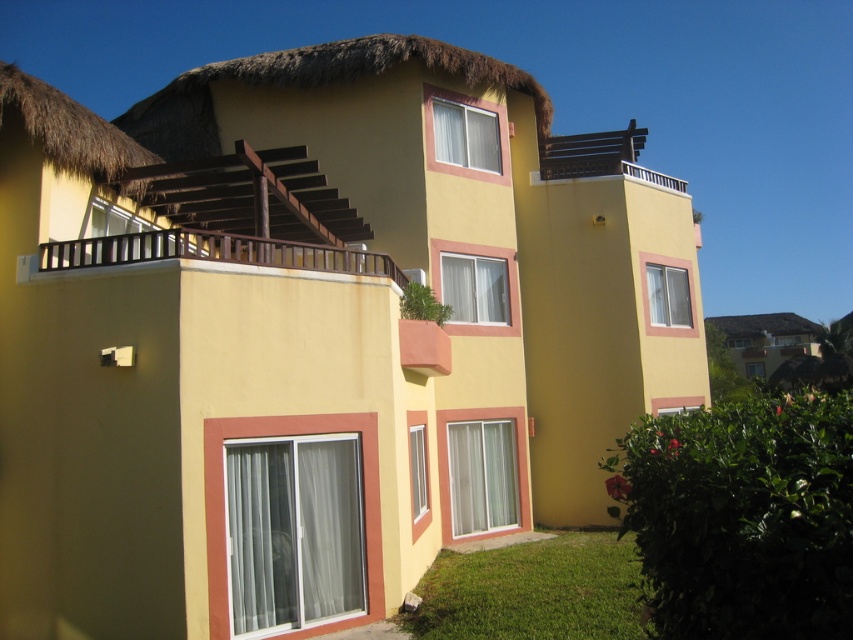
Question: Which object is positioned closest to the thatched straw hut at upper right?

Choices:
 (A) thatched straw roof at upper right
 (B) wooden at upper left
 (C) white wooden balcony at upper center

Answer: (A)

Question: Can you confirm if thatched straw hut at upper right is positioned to the right of white wooden balcony at upper center?

Choices:
 (A) no
 (B) yes

Answer: (B)

Question: Among these points, which one is nearest to the camera?

Choices:
 (A) (804, 323)
 (B) (749, 316)
 (C) (596, 145)

Answer: (C)

Question: Does wooden at upper left have a greater width compared to thatched straw hut at upper right?

Choices:
 (A) no
 (B) yes

Answer: (A)

Question: Which point is closer to the camera?

Choices:
 (A) (758, 339)
 (B) (584, 172)
 (C) (805, 333)
 (D) (299, 260)

Answer: (D)

Question: Can you confirm if thatched straw hut at upper right is bigger than white wooden balcony at upper center?

Choices:
 (A) no
 (B) yes

Answer: (A)